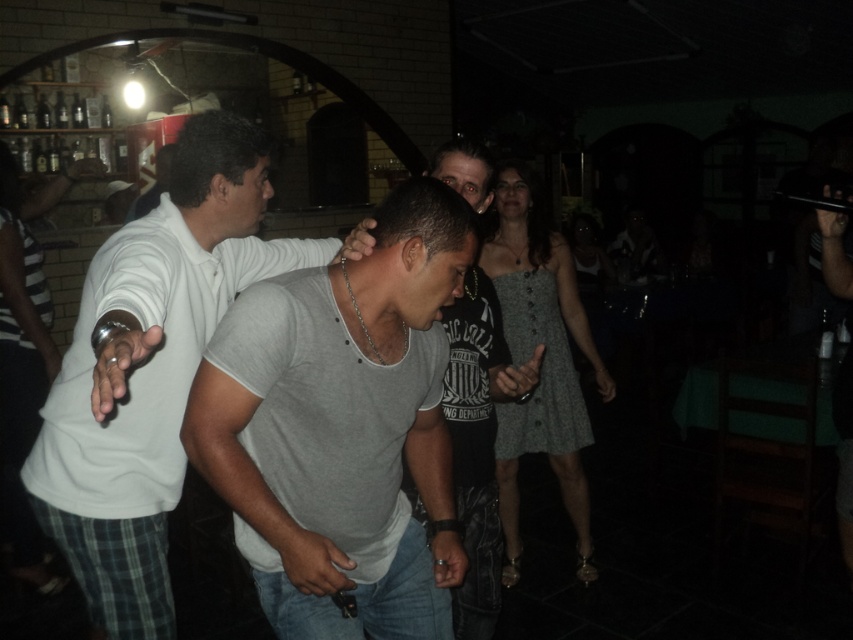
Between gray cotton shirt at center and white matte shirt at center, which one appears on the left side from the viewer's perspective?

white matte shirt at center

Does point (213, 476) come farther from viewer compared to point (242, 282)?

No, it is not.

Who is more distant from viewer, (322, 506) or (224, 193)?

Point (224, 193)

This screenshot has width=853, height=640. Find the location of `gray cotton shirt at center`. gray cotton shirt at center is located at coordinates (341, 426).

Which is behind, point (140, 424) or point (482, 468)?

The point (482, 468) is behind.

Is white matte shirt at center positioned in front of gray cotton t-shirt at center?

That is True.

Identify the location of white matte shirt at center. (152, 369).

Is gray cotton shirt at center smaller than gray cotton t-shirt at center?

Yes.

Find the location of a particular element. This screenshot has width=853, height=640. gray cotton shirt at center is located at coordinates (341, 426).

Is point (305, 412) positioned after point (526, 378)?

That is False.

The height and width of the screenshot is (640, 853). Find the location of `gray cotton shirt at center`. gray cotton shirt at center is located at coordinates (341, 426).